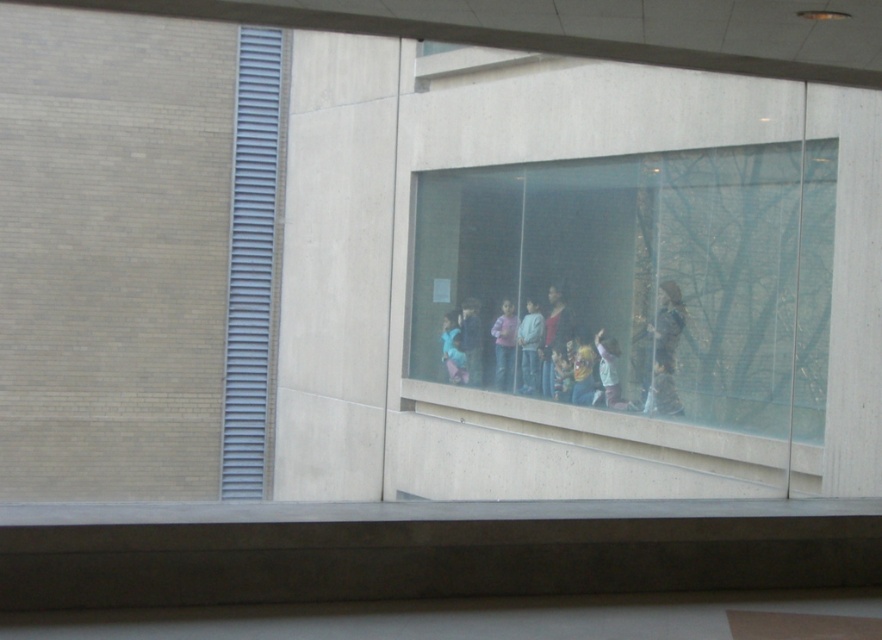
You are an architect analyzing the building layout. The point at coordinates (529, 348) is marked on the glass wall. What is located at that point?

The point at coordinates (529, 348) indicates light blue fabric at center.

You are standing in front of the building with the large glass window. You notice two points marked on the glass at coordinates point [512,166] and point [477,385]. If you want to touch both points starting from the nearest one, which point should you reach for first?

You should reach for point [512,166] first because it is closer to the camera than point [477,385].

Looking at this image, you are an interior designer planning to place a large sculpture in the space between the transparent glass window at center and the matte pink sweater at center. Based on their widths, which object should you consider to ensure the sculpture fits properly?

The transparent glass window at center is wider than the matte pink sweater at center. Therefore, the sculpture should be placed near the transparent glass window at center to accommodate its width.